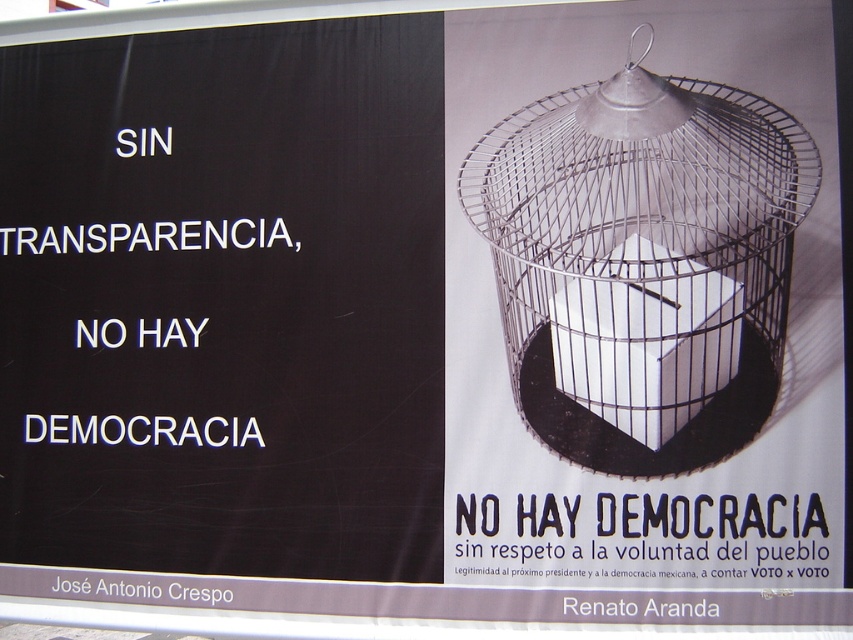
You are an artist analyzing this political poster. You notice the black paper at upper center and the metallic wire birdcage at right. Which object is closer to the viewer?

The metallic wire birdcage at right is closer to the viewer because the black paper at upper center is behind it.

Based on the scene described, which object is taller between the metallic wire birdcage at right and the black paper at upper center?

The metallic wire birdcage at right is much taller than the black paper at upper center according to the description.